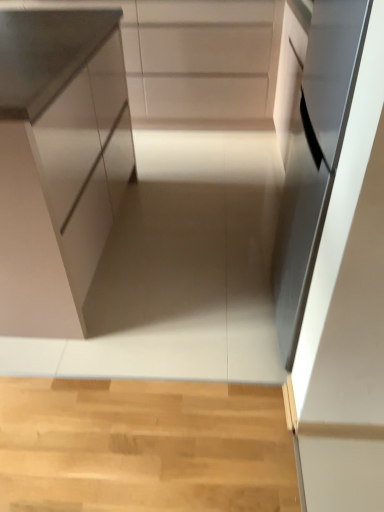
Question: Does satin black oven at right contain white matte cabinet at upper center, the 2th cabinetry positioned from the bottom?

Choices:
 (A) no
 (B) yes

Answer: (A)

Question: Is satin black oven at right closer to camera compared to white matte cabinet at upper center, the 2th cabinetry positioned from the bottom?

Choices:
 (A) no
 (B) yes

Answer: (B)

Question: Is satin black oven at right at the right side of white matte cabinet at upper center, marked as the 1th cabinetry in a back-to-front arrangement?

Choices:
 (A) no
 (B) yes

Answer: (B)

Question: Does satin black oven at right have a larger size compared to white matte cabinet at upper center, positioned as the first cabinetry in top-to-bottom order?

Choices:
 (A) no
 (B) yes

Answer: (A)

Question: From a real-world perspective, is satin black oven at right beneath white matte cabinet at upper center, the 2th cabinetry positioned from the bottom?

Choices:
 (A) no
 (B) yes

Answer: (A)

Question: In the image, is satin black oven at right positioned in front of or behind white matte cabinet at upper center, the 2th cabinetry positioned from the bottom?

Choices:
 (A) front
 (B) behind

Answer: (A)

Question: Is point (327, 199) positioned closer to the camera than point (215, 70)?

Choices:
 (A) closer
 (B) farther

Answer: (A)

Question: From their relative heights in the image, would you say satin black oven at right is taller or shorter than white matte cabinet at upper center, the 2th cabinetry positioned from the bottom?

Choices:
 (A) short
 (B) tall

Answer: (B)

Question: From a real-world perspective, is satin black oven at right physically located above or below white matte cabinet at upper center, marked as the 1th cabinetry in a back-to-front arrangement?

Choices:
 (A) above
 (B) below

Answer: (A)

Question: In terms of width, does satin white cabinet at left, the second cabinetry when ordered from top to bottom, look wider or thinner when compared to white matte cabinet at upper center, positioned as the second cabinetry in front-to-back order?

Choices:
 (A) wide
 (B) thin

Answer: (A)

Question: Would you say satin white cabinet at left, the second cabinetry when ordered from top to bottom, is inside or outside white matte cabinet at upper center, positioned as the first cabinetry in top-to-bottom order?

Choices:
 (A) inside
 (B) outside

Answer: (B)

Question: Relative to white matte cabinet at upper center, marked as the 1th cabinetry in a back-to-front arrangement, is satin white cabinet at left, the first cabinetry positioned from the front, in front or behind?

Choices:
 (A) front
 (B) behind

Answer: (A)

Question: From a real-world perspective, is satin white cabinet at left, which is the 1th cabinetry in bottom-to-top order, positioned above or below white matte cabinet at upper center, the 2th cabinetry positioned from the bottom?

Choices:
 (A) above
 (B) below

Answer: (A)

Question: Considering their positions, is satin white cabinet at left, the first cabinetry positioned from the front, located in front of or behind satin black oven at right?

Choices:
 (A) front
 (B) behind

Answer: (B)

Question: From the image's perspective, relative to satin black oven at right, is satin white cabinet at left, the first cabinetry positioned from the front, above or below?

Choices:
 (A) below
 (B) above

Answer: (B)